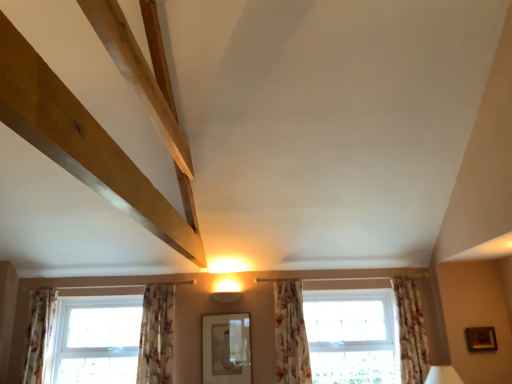
Where is `matte glass mirror at center`? matte glass mirror at center is located at coordinates (226, 348).

Image resolution: width=512 pixels, height=384 pixels. What do you see at coordinates (290, 334) in the screenshot?
I see `clear glass window at center, acting as the 2th window starting from the left` at bounding box center [290, 334].

Find the location of a particular element. clear glass window at center, which is the first window from right to left is located at coordinates (290, 334).

Measure the distance between point (9,29) and camera.

The distance of point (9,29) from camera is 3.59 feet.

Identify the location of natural wood beam at upper left. (86, 144).

Identify the location of floral fabric curtain at center, which is the third curtain from left to right. The width and height of the screenshot is (512, 384). (290, 334).

I want to click on floral fabric curtain at lower left, the 1th curtain positioned from the left, so click(38, 333).

At what (x,y) coordinates should I click in order to perform the action: click on gold metallic picture frame at lower right. Please return your answer as a coordinate pair (x, y). Image resolution: width=512 pixels, height=384 pixels. Looking at the image, I should click on (481, 339).

Based on the photo, are floral fabric curtain at lower left, placed as the third curtain when sorted from right to left, and matte glass mirror at center located far from each other?

No, there isn't a large distance between floral fabric curtain at lower left, placed as the third curtain when sorted from right to left, and matte glass mirror at center.

Does floral fabric curtain at lower left, placed as the third curtain when sorted from right to left, turn towards matte glass mirror at center?

No, floral fabric curtain at lower left, placed as the third curtain when sorted from right to left, does not turn towards matte glass mirror at center.

Where is `the 1st curtain to the left when counting from the matte glass mirror at center`? The image size is (512, 384). the 1st curtain to the left when counting from the matte glass mirror at center is located at coordinates (156, 335).

Can you tell me how much floral fabric curtain at lower left, placed as the third curtain when sorted from right to left, and matte glass mirror at center differ in facing direction?

The facing directions of floral fabric curtain at lower left, placed as the third curtain when sorted from right to left, and matte glass mirror at center are 0.634 degrees apart.

Considering the sizes of objects natural wood beam at upper left and clear glass window at lower left, the first window from the left, in the image provided, who is smaller, natural wood beam at upper left or clear glass window at lower left, the first window from the left,?

clear glass window at lower left, the first window from the left, is smaller.

Between point (89, 146) and point (131, 341), which one is positioned in front?

The point (89, 146) is more forward.

Consider the image. Is natural wood beam at upper left positioned with its back to clear glass window at lower left, which ranks as the 2th window in right-to-left order?

natural wood beam at upper left does not have its back to clear glass window at lower left, which ranks as the 2th window in right-to-left order.

Which is closer to the camera, (288, 327) or (163, 381)?

The point (163, 381) is closer to the camera.

Based on their positions, is clear glass window at center, which is the first window from right to left, located to the left or right of floral fabric curtain at lower left, which is the 2th curtain in left-to-right order?

clear glass window at center, which is the first window from right to left, is positioned on floral fabric curtain at lower left, which is the 2th curtain in left-to-right order,'s right side.

From a real-world perspective, is clear glass window at center, acting as the 2th window starting from the left, positioned under floral fabric curtain at lower left, placed as the third curtain when sorted from right to left, based on gravity?

Yes.

Measure the distance from matte white lampshade at lower right to floral fabric curtain at lower left, placed as the third curtain when sorted from right to left.

7.70 feet.

In the scene shown: Is matte white lampshade at lower right facing towards floral fabric curtain at lower left, which is the 2th curtain in left-to-right order?

No, matte white lampshade at lower right is not aimed at floral fabric curtain at lower left, which is the 2th curtain in left-to-right order.

Considering the relative positions of matte white lampshade at lower right and floral fabric curtain at lower left, placed as the third curtain when sorted from right to left, in the image provided, is matte white lampshade at lower right to the right of floral fabric curtain at lower left, placed as the third curtain when sorted from right to left, from the viewer's perspective?

Yes.

How different are the orientations of matte white lampshade at lower right and floral fabric curtain at lower left, which is the 2th curtain in left-to-right order, in degrees?

The angular difference between matte white lampshade at lower right and floral fabric curtain at lower left, which is the 2th curtain in left-to-right order, is 36.5 degrees.

Considering the sizes of matte white lampshade at lower right and clear glass window at lower left, which ranks as the 2th window in right-to-left order, in the image, is matte white lampshade at lower right bigger or smaller than clear glass window at lower left, which ranks as the 2th window in right-to-left order,?

Clearly, matte white lampshade at lower right is smaller in size than clear glass window at lower left, which ranks as the 2th window in right-to-left order.

Is the depth of matte white lampshade at lower right greater than that of clear glass window at lower left, which ranks as the 2th window in right-to-left order?

No, it is not.

Is matte white lampshade at lower right beside clear glass window at lower left, which ranks as the 2th window in right-to-left order?

No, matte white lampshade at lower right is not in contact with clear glass window at lower left, which ranks as the 2th window in right-to-left order.

From the image's perspective, is matte white lampshade at lower right located beneath clear glass window at lower left, the first window from the left?

Yes.

Does clear glass window at lower left, which ranks as the 2th window in right-to-left order, touch floral fabric curtain at right, the fourth curtain positioned from the left?

No, clear glass window at lower left, which ranks as the 2th window in right-to-left order, is not in contact with floral fabric curtain at right, the fourth curtain positioned from the left.

Can floral fabric curtain at right, the first curtain positioned from the right, be found inside clear glass window at lower left, the first window from the left?

That's incorrect, floral fabric curtain at right, the first curtain positioned from the right, is not inside clear glass window at lower left, the first window from the left.

Does clear glass window at lower left, the first window from the left, have a lesser width compared to floral fabric curtain at right, the first curtain positioned from the right?

Correct, the width of clear glass window at lower left, the first window from the left, is less than that of floral fabric curtain at right, the first curtain positioned from the right.

Considering the relative sizes of clear glass window at lower left, which ranks as the 2th window in right-to-left order, and floral fabric curtain at right, the fourth curtain positioned from the left, in the image provided, is clear glass window at lower left, which ranks as the 2th window in right-to-left order, taller than floral fabric curtain at right, the fourth curtain positioned from the left,?

No.

Is matte white lampshade at lower right looking in the opposite direction of natural wood beam at upper left?

No, natural wood beam at upper left is not at the back of matte white lampshade at lower right.

Are matte white lampshade at lower right and natural wood beam at upper left beside each other?

No.

Does matte white lampshade at lower right appear on the left side of natural wood beam at upper left?

Incorrect, matte white lampshade at lower right is not on the left side of natural wood beam at upper left.

Between matte white lampshade at lower right and natural wood beam at upper left, which one has more height?

natural wood beam at upper left is taller.

I want to click on the 1st curtain counting from the left of the matte glass mirror at center, so click(x=156, y=335).

The image size is (512, 384). In order to click on plank in front of the clear glass window at lower left, which ranks as the 2th window in right-to-left order in this screenshot , I will do `click(86, 144)`.

In the scene shown: When comparing their distances from floral fabric curtain at center, which is the third curtain from left to right, does floral fabric curtain at lower left, placed as the third curtain when sorted from right to left, or matte white lampshade at lower right seem closer?

floral fabric curtain at lower left, placed as the third curtain when sorted from right to left, is closer to floral fabric curtain at center, which is the third curtain from left to right.

Looking at the image, which one is located further to floral fabric curtain at lower left, placed as the third curtain when sorted from right to left, clear glass window at lower left, which ranks as the 2th window in right-to-left order, or gold metallic picture frame at lower right?

The object further to floral fabric curtain at lower left, placed as the third curtain when sorted from right to left, is gold metallic picture frame at lower right.

When comparing their distances from matte white lampshade at lower right, does clear glass window at lower left, the first window from the left, or floral fabric curtain at lower left, placed as the third curtain when sorted from right to left, seem closer?

Based on the image, clear glass window at lower left, the first window from the left, appears to be nearer to matte white lampshade at lower right.

From the image, which object appears to be farther from floral fabric curtain at right, the first curtain positioned from the right, clear glass window at center, acting as the 2th window starting from the left, or clear glass window at lower left, which ranks as the 2th window in right-to-left order?

The object further to floral fabric curtain at right, the first curtain positioned from the right, is clear glass window at lower left, which ranks as the 2th window in right-to-left order.

From the picture: Based on their spatial positions, is gold metallic picture frame at lower right or matte glass mirror at center further from clear glass window at lower left, the first window from the left?

gold metallic picture frame at lower right is positioned further to the anchor clear glass window at lower left, the first window from the left.

From the picture: Looking at the image, which one is located further to clear glass window at center, which is the first window from right to left, matte white lampshade at lower right or matte glass mirror at center?

Among the two, matte white lampshade at lower right is located further to clear glass window at center, which is the first window from right to left.

From the image, which object appears to be nearer to floral fabric curtain at lower left, which is the 2th curtain in left-to-right order, floral fabric curtain at lower left, the 1th curtain positioned from the left, or natural wood beam at upper left?

floral fabric curtain at lower left, the 1th curtain positioned from the left, is closer to floral fabric curtain at lower left, which is the 2th curtain in left-to-right order.

Based on the photo, which object lies further to the anchor point clear glass window at center, acting as the 2th window starting from the left, clear glass window at lower left, the first window from the left, or natural wood beam at upper left?

natural wood beam at upper left is further to clear glass window at center, acting as the 2th window starting from the left.

The image size is (512, 384). Find the location of `mirror between clear glass window at lower left, which ranks as the 2th window in right-to-left order, and clear glass window at center, which is the first window from right to left, from left to right`. mirror between clear glass window at lower left, which ranks as the 2th window in right-to-left order, and clear glass window at center, which is the first window from right to left, from left to right is located at coordinates (226, 348).

Identify the location of mirror between clear glass window at lower left, the first window from the left, and floral fabric curtain at center, which is the third curtain from left to right, in the horizontal direction. (226, 348).

Where is `picture frame between natural wood beam at upper left and floral fabric curtain at lower left, which is the 2th curtain in left-to-right order, in the front-back direction`? Image resolution: width=512 pixels, height=384 pixels. picture frame between natural wood beam at upper left and floral fabric curtain at lower left, which is the 2th curtain in left-to-right order, in the front-back direction is located at coordinates (481, 339).

The width and height of the screenshot is (512, 384). Identify the location of curtain between clear glass window at lower left, which ranks as the 2th window in right-to-left order, and matte glass mirror at center. (156, 335).